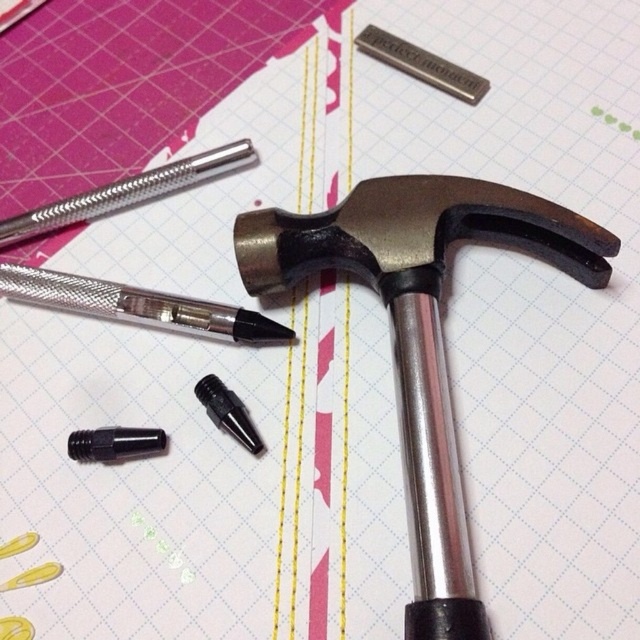
You are organizing tools on a grid mat. You need to place the metallic textured pen at upper left and the black plastic screwdriver at lower left. According to the image, which tool is closer to the viewer?

The metallic textured pen at upper left is closer to the viewer because the black plastic screwdriver at lower left is behind it.

You are organizing tools on a grid mat and need to place the metallic textured pen at upper left and the black plastic screwdriver at lower left. Based on their positions, which tool is closer to the top edge of the mat?

The metallic textured pen at upper left is closer to the top edge of the mat because it is positioned over the black plastic screwdriver at lower left.

Based on the photo, you are organizing tools on a grid mat and need to place the metallic silver pen at upper left and the black plastic screwdriver at lower left. Based on their positions, which tool is closer to the top edge of the mat?

The metallic silver pen at upper left is closer to the top edge of the mat since it is positioned on the left side of the black plastic screwdriver at lower left, which is located further down.